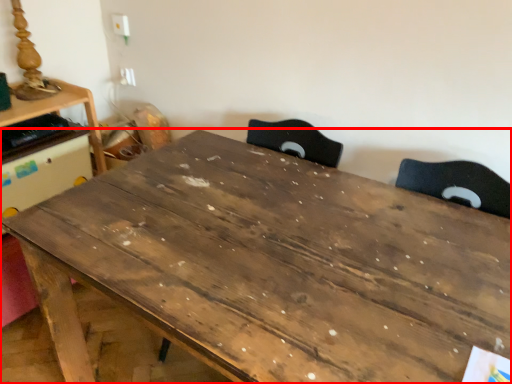
Question: From the image's perspective, where is table (annotated by the red box) located relative to table?

Choices:
 (A) above
 (B) below

Answer: (B)